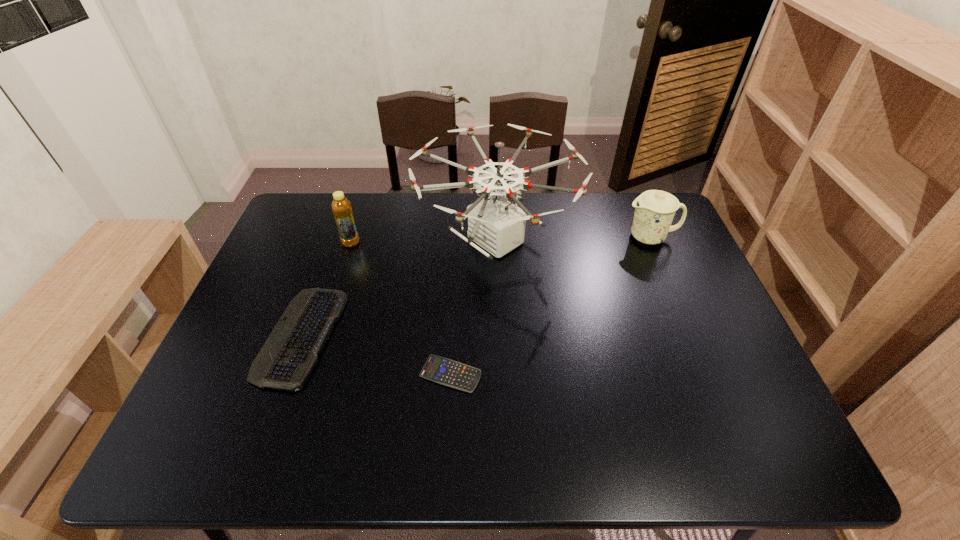
Image resolution: width=960 pixels, height=540 pixels. Identify the location of the tallest object. (497, 225).

Identify the location of bottle. click(x=341, y=207).

You are a GUI agent. You are given a task and a screenshot of the screen. Output one action in this format:
    pyautogui.click(x=<x>, y=<y>)
    Task: Click on the rightmost object
    The width and height of the screenshot is (960, 540).
    Given the screenshot: What is the action you would take?
    pyautogui.click(x=654, y=210)

At what (x,y) coordinates should I click in order to perform the action: click on the fourth tallest object. Please return your answer as a coordinate pair (x, y). Looking at the image, I should click on pyautogui.click(x=287, y=358).

Where is `calculator`? calculator is located at coordinates (441, 370).

Identify the location of free space located 0.220m on the right of the drone. (645, 241).

Locate an element on the screen. Image resolution: width=960 pixels, height=540 pixels. blank area located on the front of the bottle is located at coordinates pos(323,333).

Locate an element on the screen. The width and height of the screenshot is (960, 540). free space located 0.300m on the spout of the rightmost object is located at coordinates pos(529,238).

The height and width of the screenshot is (540, 960). I want to click on vacant space located on the spout of the rightmost object, so click(x=561, y=238).

Where is `vacant space located on the spout of the rightmost object`? vacant space located on the spout of the rightmost object is located at coordinates (548, 238).